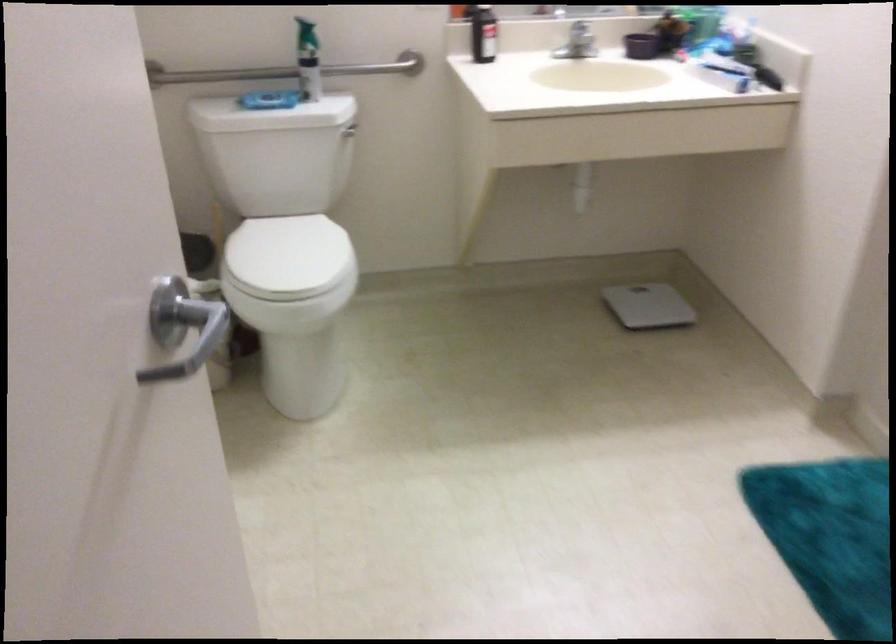
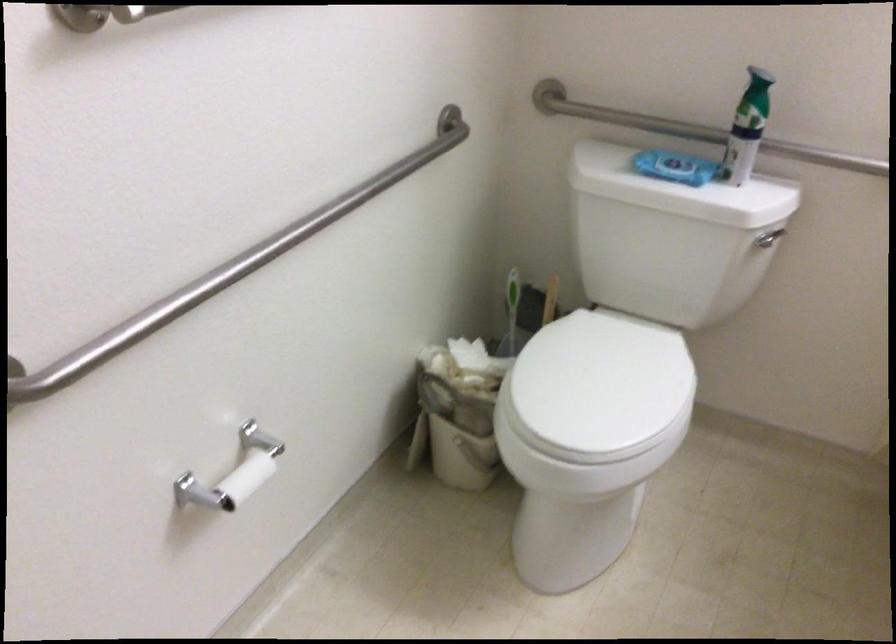
Where in the second image is the point corresponding to the point at 287,113 from the first image?

(678, 190)